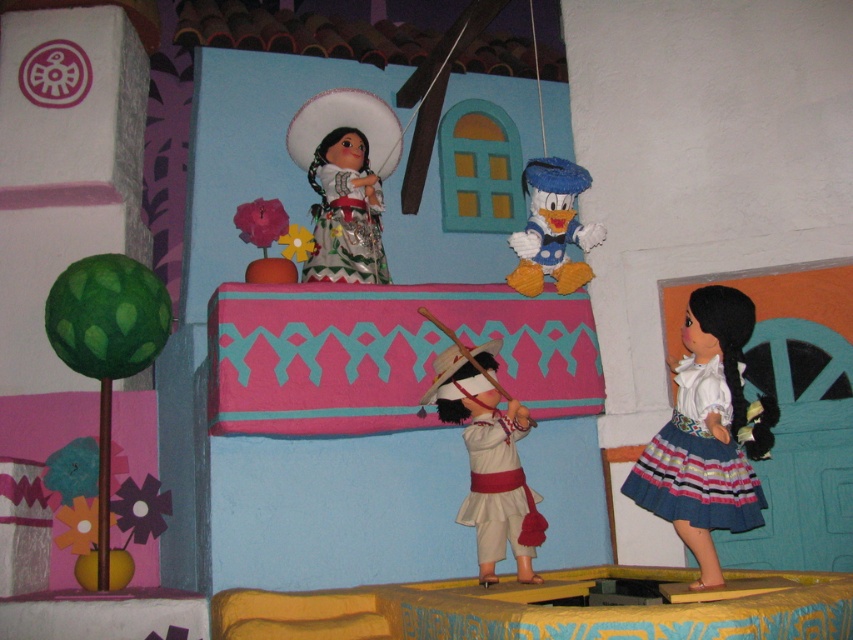
You are a visitor standing in front of the diorama. You want to take a photo of the matte white doll at upper center without the striped cotton skirt at lower right appearing in the background. Is this possible based on their positions?

The matte white doll at upper center is further to the viewer than the striped cotton skirt at lower right. Since the doll is closer to you, you can position yourself so that the skirt is out of the frame or obscured, allowing you to take a photo of the matte white doll at upper center without the striped cotton skirt at lower right in the background.

You are a small toy car that is 12 inches long. You want to move from the matte white doll at upper center to the white matte doll at center. Can you fit through the space between them?

The distance between the matte white doll at upper center and the white matte doll at center is 27.46 inches. Since the toy car is only 12 inches long, it can easily fit through the space between them.

You are a visitor to this diorama and want to place a small decoration exactly at the position of the matte white doll at upper center. What are the coordinates where you should place it?

The coordinates for the matte white doll at upper center are 0.283 on the x axis and 0.406 on the y axis.